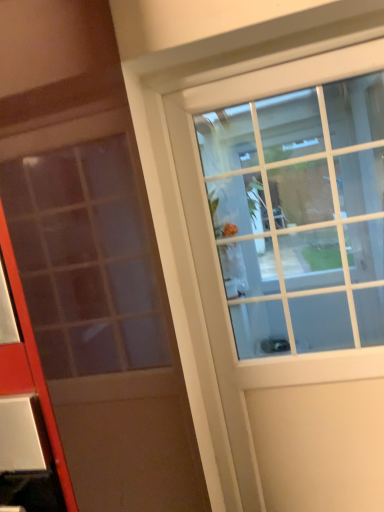
Question: Can you confirm if white glass door at upper right, the 1th door when ordered from right to left, is bigger than matte glass door at center, which is the second door from right to left?

Choices:
 (A) yes
 (B) no

Answer: (B)

Question: Does white glass door at upper right, the second door positioned from the left, appear on the right side of matte glass door at center, which is the first door in front-to-back order?

Choices:
 (A) no
 (B) yes

Answer: (B)

Question: From a real-world perspective, is white glass door at upper right, the second door positioned from the left, over matte glass door at center, marked as the second door in a back-to-front arrangement?

Choices:
 (A) no
 (B) yes

Answer: (A)

Question: Is white glass door at upper right, the second door positioned from the left, facing towards matte glass door at center, marked as the second door in a back-to-front arrangement?

Choices:
 (A) yes
 (B) no

Answer: (B)

Question: Is white glass door at upper right, the 1th door when ordered from back to front, located outside matte glass door at center, which is the 1th door in left-to-right order?

Choices:
 (A) yes
 (B) no

Answer: (A)

Question: Is white glass door at upper right, the 1th door when ordered from right to left, behind matte glass door at center, which is the first door in front-to-back order?

Choices:
 (A) no
 (B) yes

Answer: (B)

Question: Is matte glass door at center, which is the first door in front-to-back order, at the right side of white glass door at upper right, the 1th door when ordered from right to left?

Choices:
 (A) yes
 (B) no

Answer: (B)

Question: Is matte glass door at center, marked as the second door in a back-to-front arrangement, wider than white glass door at upper right, placed as the second door when sorted from front to back?

Choices:
 (A) yes
 (B) no

Answer: (A)

Question: Does matte glass door at center, which is the first door in front-to-back order, appear on the left side of white glass door at upper right, the 1th door when ordered from right to left?

Choices:
 (A) yes
 (B) no

Answer: (A)

Question: Could you tell me if matte glass door at center, which is the 1th door in left-to-right order, is turned towards white glass door at upper right, placed as the second door when sorted from front to back?

Choices:
 (A) no
 (B) yes

Answer: (A)

Question: Is matte glass door at center, which is the second door from right to left, shorter than white glass door at upper right, the second door positioned from the left?

Choices:
 (A) no
 (B) yes

Answer: (B)

Question: Can you confirm if matte glass door at center, marked as the second door in a back-to-front arrangement, is smaller than white glass door at upper right, the second door positioned from the left?

Choices:
 (A) yes
 (B) no

Answer: (B)

Question: Is white glass door at upper right, the 1th door when ordered from back to front, bigger or smaller than matte glass door at center, marked as the second door in a back-to-front arrangement?

Choices:
 (A) big
 (B) small

Answer: (B)